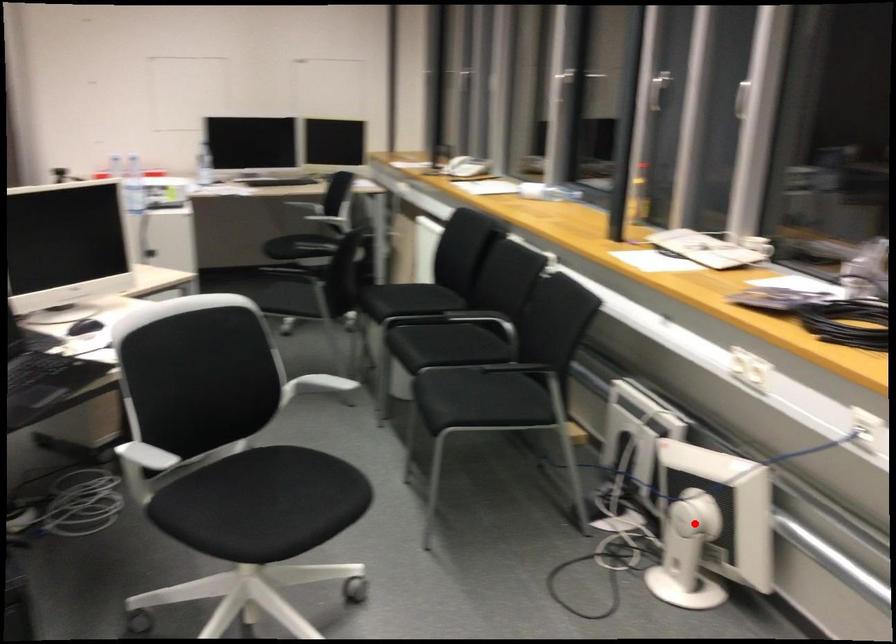
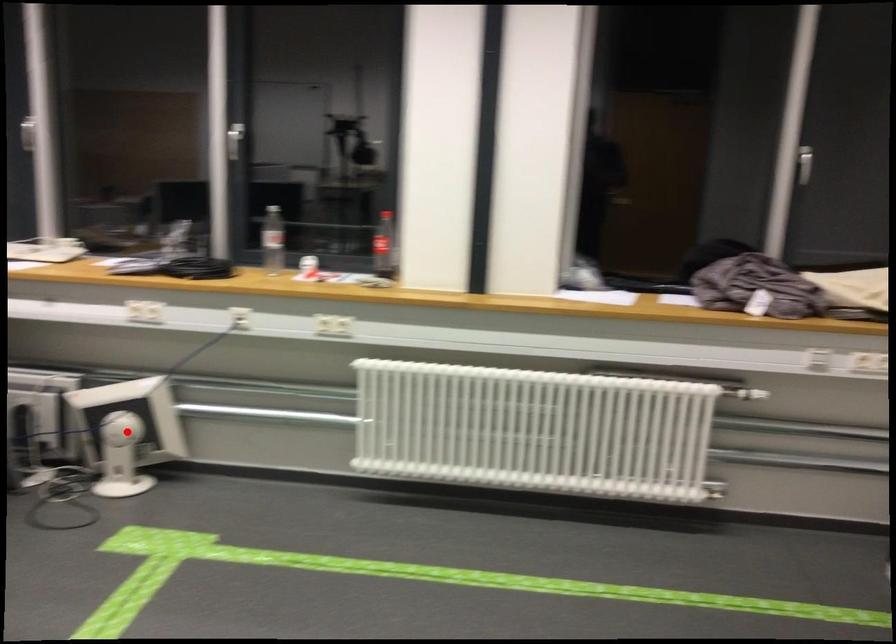
I am providing you with two images of the same scene from different viewpoints. A red point is marked on the first image and another point is marked on the second image. Do the highlighted points in image1 and image2 indicate the same real-world spot?

No